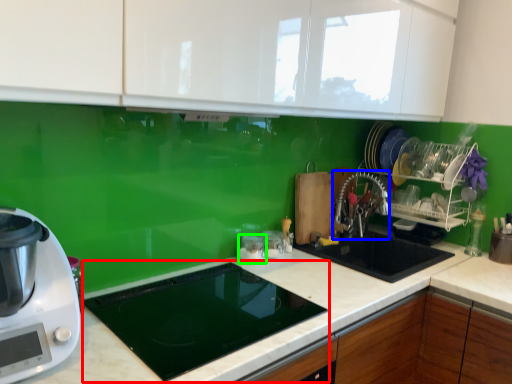
Question: Estimate the real-world distances between objects in this image. Which object is farther from appliance (highlighted by a red box), faucet (highlighted by a blue box) or appliance (highlighted by a green box)?

Choices:
 (A) faucet
 (B) appliance

Answer: (A)